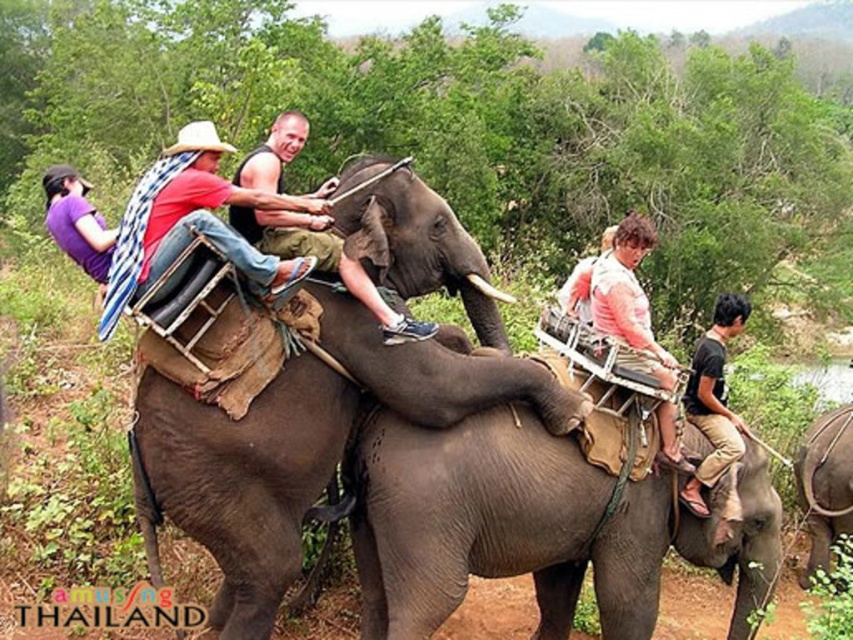
You are a photographer trying to capture the riders on the elephants. You notice two points marked in the image. Which point, point (386, 330) or point (80, 186), is closer to your camera lens?

Point (386, 330) is closer to the camera lens than point (80, 186).

Based on the coordinates provided, what object is located at point (537, 524) in the image?

The point (537, 524) indicates the gray matte elephant at center.